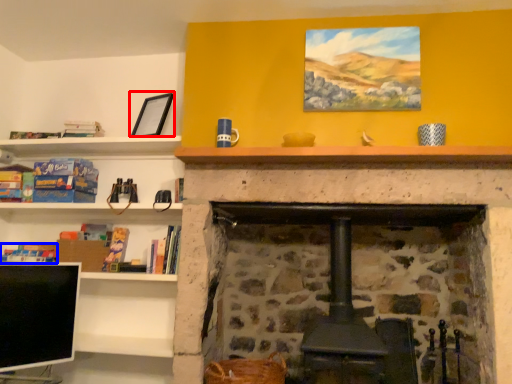
Question: Which of the following is the farthest to the observer, picture frame (highlighted by a red box) or book (highlighted by a blue box)?

Choices:
 (A) picture frame
 (B) book

Answer: (B)